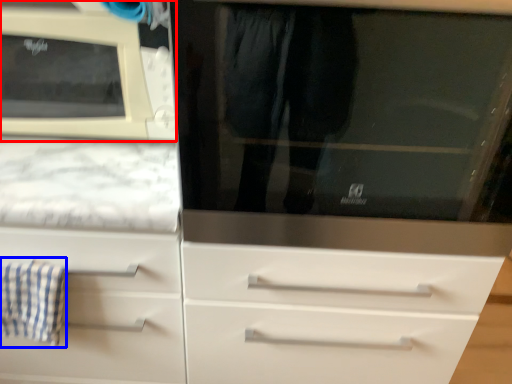
Question: Which of the following is the farthest to the observer, microwave oven (highlighted by a red box) or bath towel (highlighted by a blue box)?

Choices:
 (A) microwave oven
 (B) bath towel

Answer: (B)